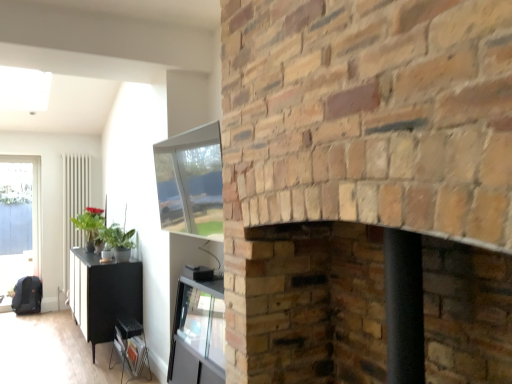
Question: Is green matte plant at left aimed at brick fireplace at center, arranged as the first fireplace when viewed from the top?

Choices:
 (A) yes
 (B) no

Answer: (B)

Question: Would you say brick fireplace at center, the second fireplace ordered from the bottom, is part of green matte plant at left's contents?

Choices:
 (A) no
 (B) yes

Answer: (A)

Question: Is green matte plant at left in contact with brick fireplace at center, the second fireplace ordered from the bottom?

Choices:
 (A) yes
 (B) no

Answer: (B)

Question: Is green matte plant at left facing away from brick fireplace at center, arranged as the first fireplace when viewed from the top?

Choices:
 (A) no
 (B) yes

Answer: (A)

Question: Considering the relative sizes of green matte plant at left and brick fireplace at center, arranged as the first fireplace when viewed from the top, in the image provided, is green matte plant at left shorter than brick fireplace at center, arranged as the first fireplace when viewed from the top,?

Choices:
 (A) yes
 (B) no

Answer: (A)

Question: From the image's perspective, is white glossy radiator at left located above or below green matte plant at left?

Choices:
 (A) above
 (B) below

Answer: (B)

Question: Is white glossy radiator at left to the left or to the right of green matte plant at left in the image?

Choices:
 (A) right
 (B) left

Answer: (B)

Question: In terms of width, does white glossy radiator at left look wider or thinner when compared to green matte plant at left?

Choices:
 (A) wide
 (B) thin

Answer: (B)

Question: From a real-world perspective, is white glossy radiator at left physically located above or below green matte plant at left?

Choices:
 (A) below
 (B) above

Answer: (A)

Question: Is point (455, 382) closer or farther from the camera than point (7, 251)?

Choices:
 (A) closer
 (B) farther

Answer: (A)

Question: From a real-world perspective, relative to transparent glass door at left, is smooth brick fireplace at center, which ranks as the 1th fireplace in bottom-to-top order, vertically above or below?

Choices:
 (A) above
 (B) below

Answer: (B)

Question: Is smooth brick fireplace at center, which ranks as the 1th fireplace in bottom-to-top order, to the left or to the right of transparent glass door at left in the image?

Choices:
 (A) left
 (B) right

Answer: (B)

Question: From their relative heights in the image, would you say smooth brick fireplace at center, acting as the second fireplace starting from the top, is taller or shorter than transparent glass door at left?

Choices:
 (A) short
 (B) tall

Answer: (A)

Question: Is white glossy radiator at left in front of or behind brick fireplace at center, arranged as the first fireplace when viewed from the top, in the image?

Choices:
 (A) front
 (B) behind

Answer: (B)

Question: Does point (62, 233) appear closer or farther from the camera than point (361, 107)?

Choices:
 (A) farther
 (B) closer

Answer: (A)